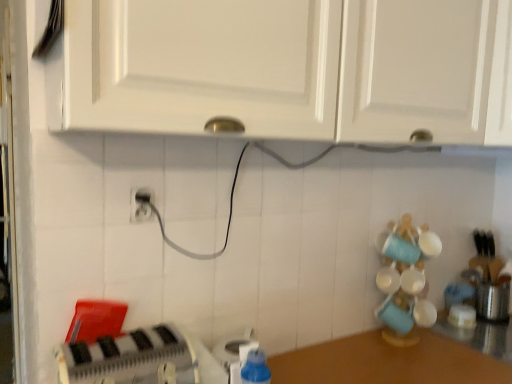
Question: Does brown wooden counter at lower right have a lesser height compared to white matte cabinet at upper center, arranged as the 1th cabinetry when viewed from the right?

Choices:
 (A) no
 (B) yes

Answer: (B)

Question: Is brown wooden counter at lower right further to camera compared to white matte cabinet at upper center, arranged as the 1th cabinetry when viewed from the right?

Choices:
 (A) yes
 (B) no

Answer: (B)

Question: From a real-world perspective, is brown wooden counter at lower right below white matte cabinet at upper center, arranged as the 2th cabinetry when viewed from the left?

Choices:
 (A) no
 (B) yes

Answer: (B)

Question: Is brown wooden counter at lower right outside of white matte cabinet at upper center, arranged as the 2th cabinetry when viewed from the left?

Choices:
 (A) yes
 (B) no

Answer: (A)

Question: From the image's perspective, would you say brown wooden counter at lower right is positioned over white matte cabinet at upper center, arranged as the 2th cabinetry when viewed from the left?

Choices:
 (A) no
 (B) yes

Answer: (A)

Question: Looking at the image, does white plastic toaster at lower left, marked as the 3th appliance in a right-to-left arrangement, seem bigger or smaller compared to white matte cabinet at upper center, placed as the 2th cabinetry when sorted from right to left?

Choices:
 (A) small
 (B) big

Answer: (A)

Question: From a real-world perspective, is white plastic toaster at lower left, which is the first appliance from front to back, physically located above or below white matte cabinet at upper center, placed as the 2th cabinetry when sorted from right to left?

Choices:
 (A) above
 (B) below

Answer: (B)

Question: Is white plastic toaster at lower left, marked as the 3th appliance in a right-to-left arrangement, inside the boundaries of white matte cabinet at upper center, placed as the 2th cabinetry when sorted from right to left, or outside?

Choices:
 (A) outside
 (B) inside

Answer: (A)

Question: Is white plastic toaster at lower left, marked as the 3th appliance in a right-to-left arrangement, taller or shorter than white matte cabinet at upper center, placed as the 1th cabinetry when sorted from left to right?

Choices:
 (A) tall
 (B) short

Answer: (B)

Question: From a real-world perspective, is satin silver toaster at right, the 1th appliance in the back-to-front sequence, above or below white matte cabinet at upper center, placed as the 2th cabinetry when sorted from right to left?

Choices:
 (A) above
 (B) below

Answer: (B)

Question: Looking at the image, does satin silver toaster at right, the third appliance viewed from the front, seem bigger or smaller compared to white matte cabinet at upper center, placed as the 2th cabinetry when sorted from right to left?

Choices:
 (A) small
 (B) big

Answer: (A)

Question: Is satin silver toaster at right, the 1th appliance in the right-to-left sequence, spatially inside white matte cabinet at upper center, placed as the 1th cabinetry when sorted from left to right, or outside of it?

Choices:
 (A) outside
 (B) inside

Answer: (A)

Question: In the image, is satin silver toaster at right, the third appliance viewed from the front, on the left side or the right side of white matte cabinet at upper center, placed as the 2th cabinetry when sorted from right to left?

Choices:
 (A) right
 (B) left

Answer: (A)

Question: From a real-world perspective, is white matte cabinet at upper center, placed as the 1th cabinetry when sorted from left to right, positioned above or below white matte cabinet at upper center, arranged as the 2th cabinetry when viewed from the left?

Choices:
 (A) below
 (B) above

Answer: (A)

Question: Is point (325, 3) closer or farther from the camera than point (470, 38)?

Choices:
 (A) farther
 (B) closer

Answer: (B)